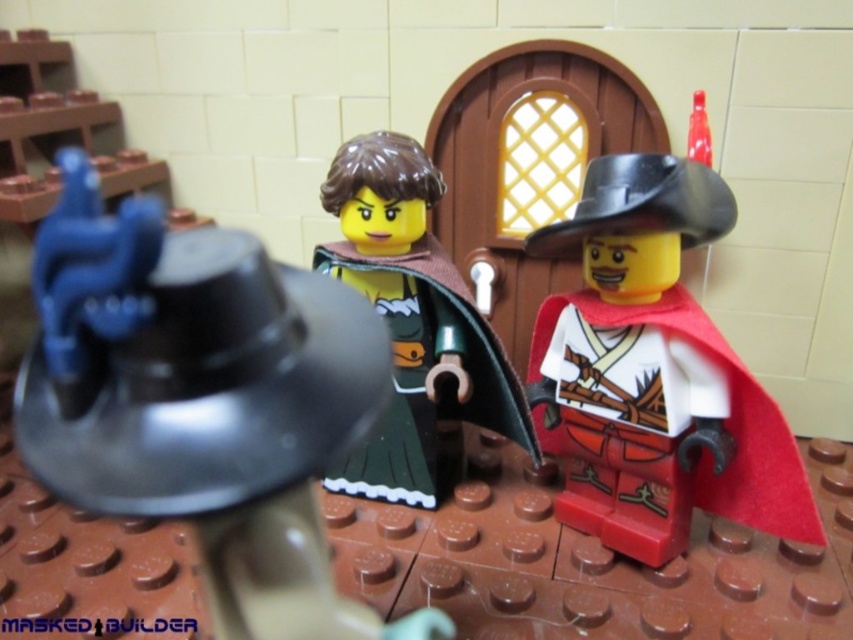
You are a LEGO figure trying to pass a note from the metallic silver helmet at upper left to the green matte dress at center. The note can only travel 20 inches. Will it reach?

The metallic silver helmet at upper left is 19.72 inches from the green matte dress at center, so yes, the note will reach because the distance is within the 20 inches limit.

Looking at the LEGO scene, there are two characters near the door. One has a smooth red cape at right and the other a green matte dress at center. Which character has a wider garment?

The smooth red cape at right is wider than the green matte dress at center.

You are a medieval knight in the LEGO scene. You need to choose between the metallic silver helmet at upper left and the smooth red cape at right to protect yourself from an incoming rainstorm. Which item would provide better coverage based on their sizes?

The smooth red cape at right is larger than the metallic silver helmet at upper left, so it would provide better coverage against the rainstorm.